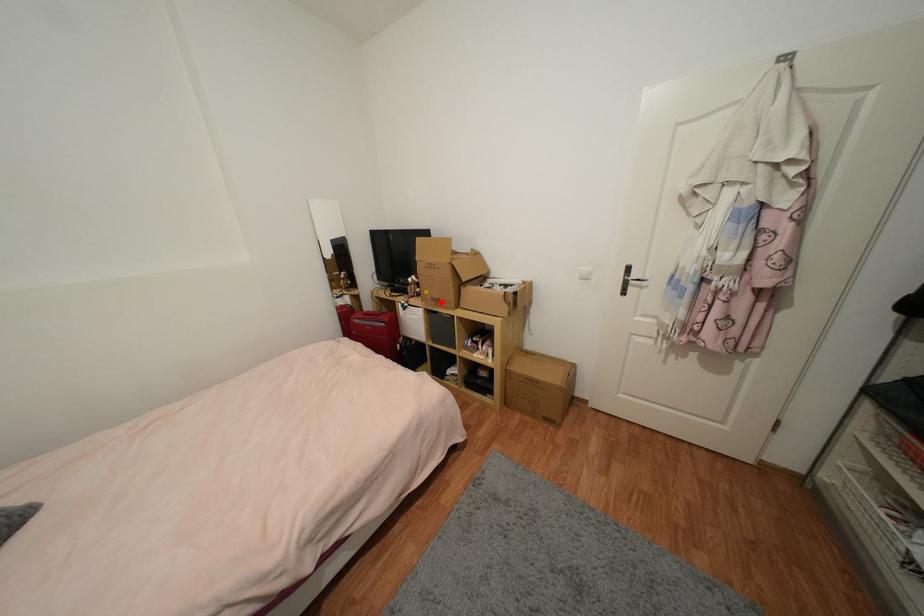
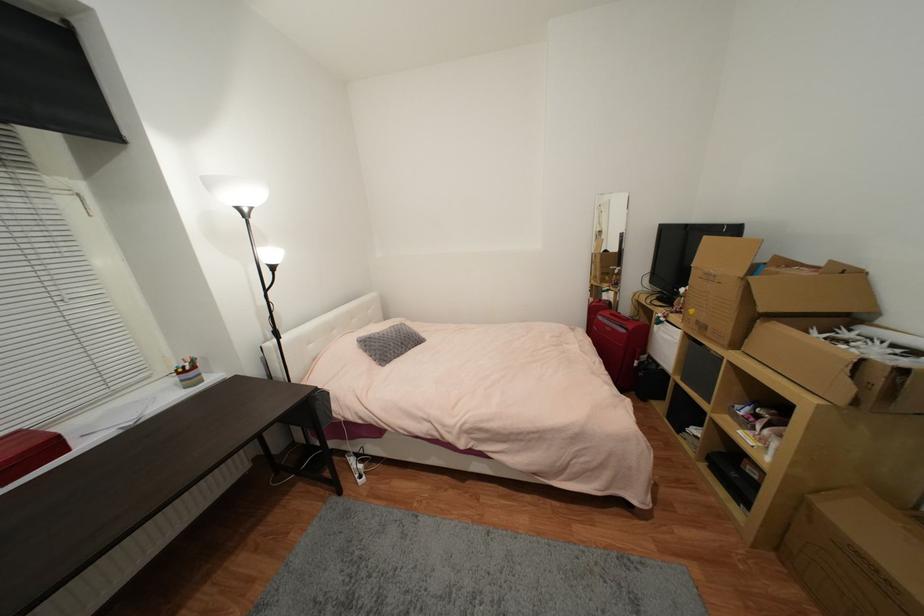
Question: A red point is marked in image1. In image2, is the corresponding 3D point closer to the camera or farther? Reply with the corresponding letter.

Choices:
 (A) The corresponding 3D point is closer.
 (B) The corresponding 3D point is farther.

Answer: (A)